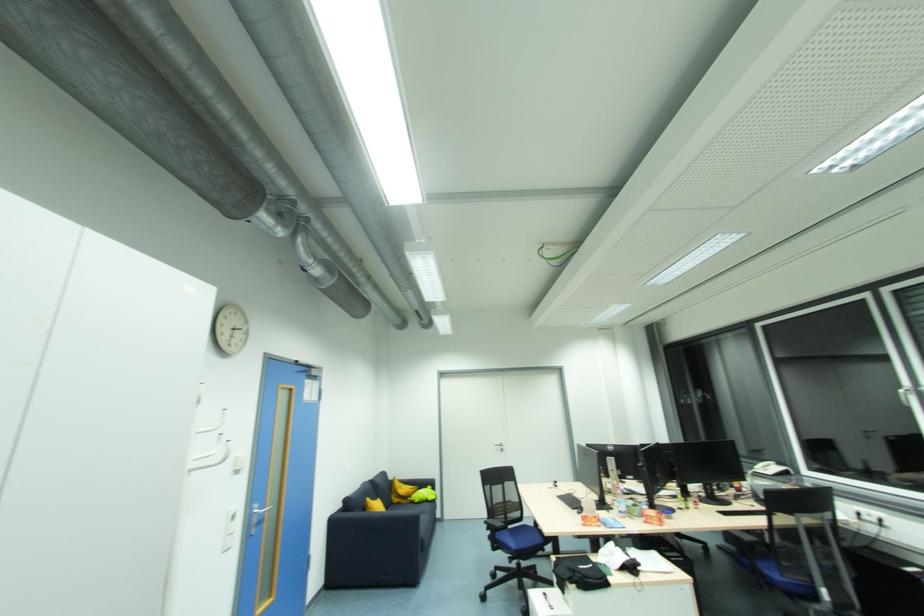
Find the location of a particular element. white light switch is located at coordinates (229, 532).